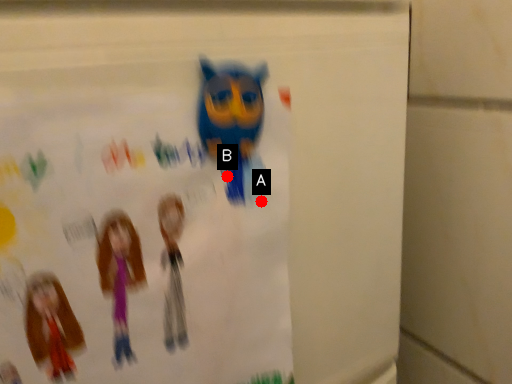
Question: Two points are circled on the image, labeled by A and B beside each circle. Which of the following is the farthest from the observer?

Choices:
 (A) A is further
 (B) B is further

Answer: (A)